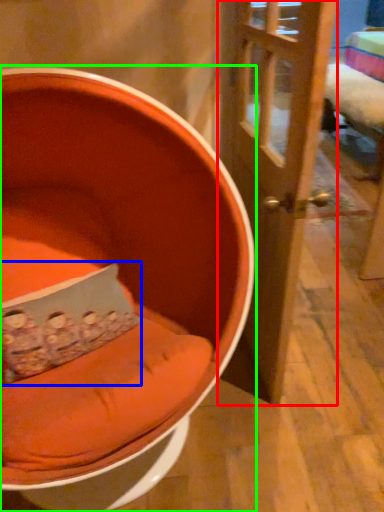
Question: Considering the real-world distances, which object is closest to door (highlighted by a red box)? pillow (highlighted by a blue box) or chair (highlighted by a green box).

Choices:
 (A) pillow
 (B) chair

Answer: (B)